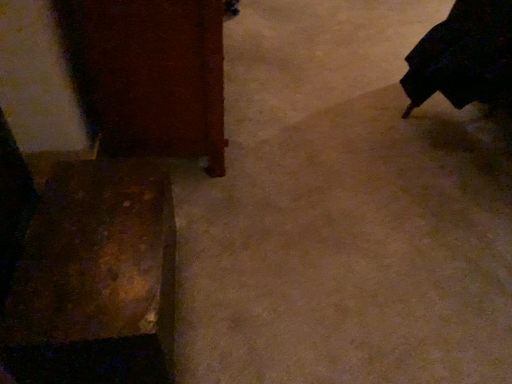
The height and width of the screenshot is (384, 512). Find the location of `free space above rusty metal box at lower left, the first furniture when ordered from bottom to top (from a real-world perspective)`. free space above rusty metal box at lower left, the first furniture when ordered from bottom to top (from a real-world perspective) is located at coordinates (79, 255).